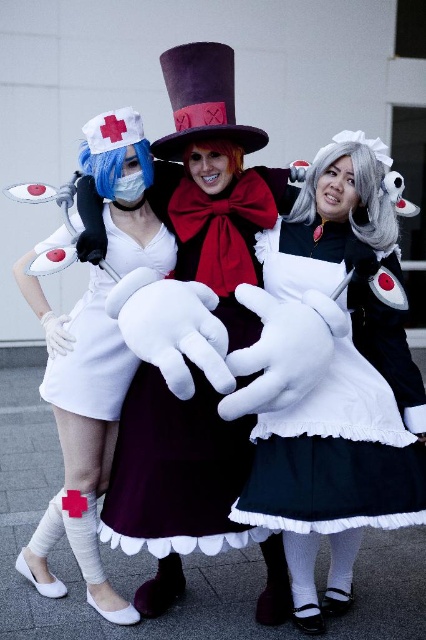
You are a photographer at a cosplay event. You need to position the white matte nurse outfit at left and the white matte dress at center so that the nurse outfit is not blocking the view of the dress. Based on their current positions, is the nurse outfit currently blocking the view of the dress?

The white matte nurse outfit at left is below the white matte dress at center, so the nurse outfit is not blocking the view of the dress since it is positioned lower.

From the picture: You are standing in front of the maroon satin dress at center and the white matte nurse outfit at left. Which costume is nearer to you?

The maroon satin dress at center is closer to the viewer than the white matte nurse outfit at left.

You are a photographer at a cosplay event. You need to arrange the white matte nurse outfit at left and the white matte dress at center so that both can fit within a 2.5 meter wide photo frame. Given their sizes, is this arrangement possible?

The white matte nurse outfit at left is wider than the white matte dress at center. However, since the total width of both together is not specified, it is possible that they can fit within the 2.5 meter frame if positioned appropriately.